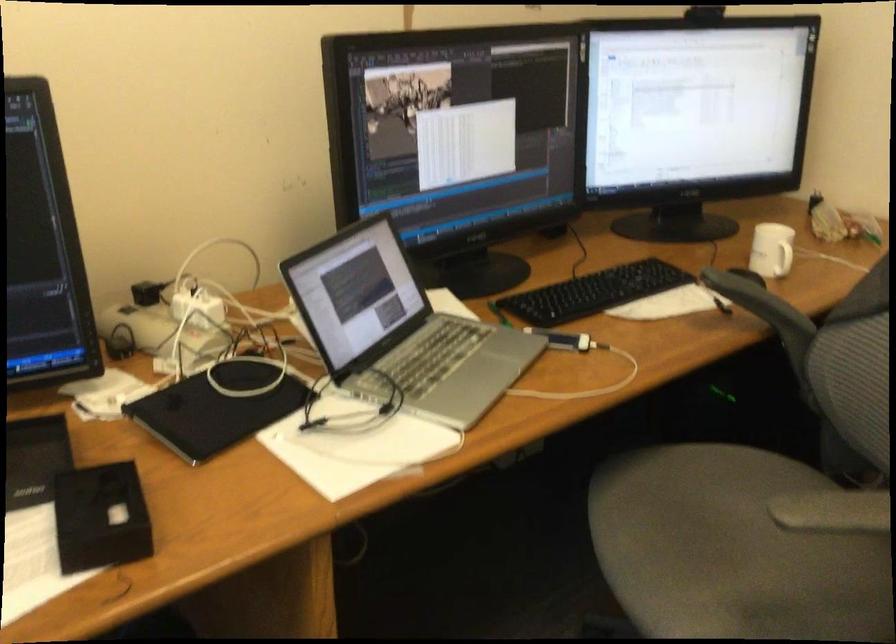
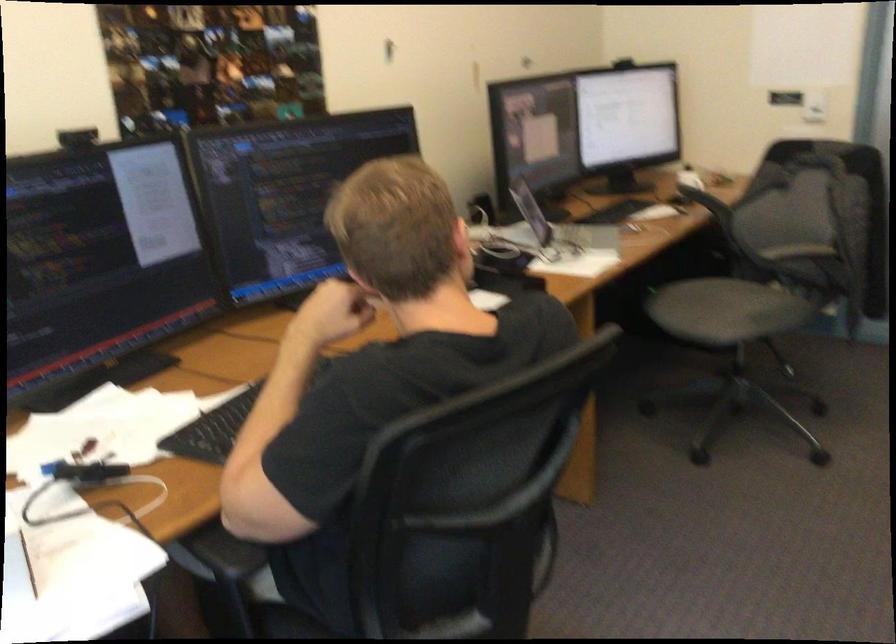
Question: I am providing you with two images of the same scene from different viewpoints. Please identify which objects are invisible in image2.

Choices:
 (A) grey chair sitting surface
 (B) spoon
 (C) white mug handle
 (D) silver laptop

Answer: (C)